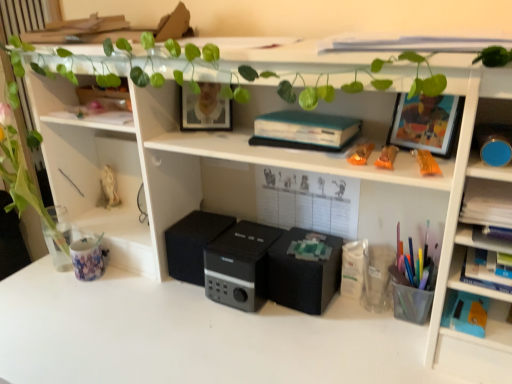
Identify the location of printed ceramic mug at left, arranged as the second stationery when viewed from the top. (88, 258).

The image size is (512, 384). What do you see at coordinates (239, 265) in the screenshot? I see `black matte speaker at center, the 2th speaker from the right` at bounding box center [239, 265].

Measure the distance between matte white statue at left and camera.

The distance of matte white statue at left from camera is 4.57 feet.

Describe the element at coordinates (304, 130) in the screenshot. The width and height of the screenshot is (512, 384). I see `teal matte book at center` at that location.

At what (x,y) coordinates should I click in order to perform the action: click on translucent orange pen at upper right, the 2th stationery viewed from the left. Please return your answer as a coordinate pair (x, y). Looking at the image, I should click on (387, 157).

Locate an element on the screen. This screenshot has height=384, width=512. printed ceramic mug at left, acting as the 3th stationery starting from the front is located at coordinates (88, 258).

From their relative heights in the image, would you say translucent plastic cup at right, which ranks as the third stationery in top-to-bottom order, is taller or shorter than green leafy plant at left?

translucent plastic cup at right, which ranks as the third stationery in top-to-bottom order, is shorter than green leafy plant at left.

In the image, is translucent plastic cup at right, which is counted as the 1th stationery, starting from the bottom, on the left side or the right side of green leafy plant at left?

In the image, translucent plastic cup at right, which is counted as the 1th stationery, starting from the bottom, appears on the right side of green leafy plant at left.

Is translucent plastic cup at right, the second stationery viewed from the front, completely or partially outside of green leafy plant at left?

Yes, translucent plastic cup at right, the second stationery viewed from the front, is located beyond the bounds of green leafy plant at left.

Is translucent plastic cup at right, marked as the third stationery in a left-to-right arrangement, bigger than green leafy plant at left?

No, translucent plastic cup at right, marked as the third stationery in a left-to-right arrangement, is not bigger than green leafy plant at left.

Would you say teal matte book at center is outside hardcover book at right?

Indeed, teal matte book at center is completely outside hardcover book at right.

Who is taller, teal matte book at center or hardcover book at right?

teal matte book at center is taller.

How many degrees apart are the facing directions of teal matte book at center and hardcover book at right?

2.97 degrees separate the facing orientations of teal matte book at center and hardcover book at right.

Which object is thinner, teal matte book at center or hardcover book at right?

teal matte book at center.

Is matte white statue at left located outside black matte speaker at center, the 2th speaker from the right?

Yes, matte white statue at left is not within black matte speaker at center, the 2th speaker from the right.

The width and height of the screenshot is (512, 384). In the image, there is a black matte speaker at center, the 2th speaker from the right. What are the coordinates of `toy above it (from the image's perspective)` in the screenshot? It's located at (108, 189).

What's the angular difference between matte white statue at left and black matte speaker at center, which is the 2th speaker from left to right,'s facing directions?

The facing directions of matte white statue at left and black matte speaker at center, which is the 2th speaker from left to right, are 3.46 degrees apart.

Does matte white statue at left turn towards black matte speaker at center, the 2th speaker from the right?

No, matte white statue at left is not oriented towards black matte speaker at center, the 2th speaker from the right.

In the scene shown: Measure the distance from black matte speaker at center, which is the third speaker in right-to-left order, to black matte speaker at center, positioned as the first speaker in right-to-left order.

black matte speaker at center, which is the third speaker in right-to-left order, is 10.19 inches from black matte speaker at center, positioned as the first speaker in right-to-left order.

From the image's perspective, who appears lower, black matte speaker at center, which is the third speaker in right-to-left order, or black matte speaker at center, positioned as the first speaker in right-to-left order?

black matte speaker at center, positioned as the first speaker in right-to-left order, from the image's perspective.

From a real-world perspective, between black matte speaker at center, which is the 1th speaker in left-to-right order, and black matte speaker at center, positioned as the first speaker in right-to-left order, who is vertically higher?

In real-world perspective, black matte speaker at center, which is the 1th speaker in left-to-right order, is above.

Can you confirm if black matte speaker at center, which is the 1th speaker in left-to-right order, is smaller than black matte speaker at center, positioned as the first speaker in right-to-left order?

No, black matte speaker at center, which is the 1th speaker in left-to-right order, is not smaller than black matte speaker at center, positioned as the first speaker in right-to-left order.

Is translucent orange pen at upper right, which is the 1th stationery from top to bottom, aimed at hardcover book at right?

No, translucent orange pen at upper right, which is the 1th stationery from top to bottom, is not turned towards hardcover book at right.

From the picture: Who is bigger, translucent orange pen at upper right, arranged as the 2th stationery when viewed from the right, or hardcover book at right?

hardcover book at right is bigger.

Identify the location of stationery above the hardcover book at right (from the image's perspective). (387, 157).

How much distance is there between translucent orange pen at upper right, the 3th stationery when ordered from bottom to top, and hardcover book at right?

translucent orange pen at upper right, the 3th stationery when ordered from bottom to top, is 10.25 inches away from hardcover book at right.

Would you say teal matte book at center is outside translucent plastic cup at right, the second stationery viewed from the front?

Absolutely, teal matte book at center is external to translucent plastic cup at right, the second stationery viewed from the front.

Which of these two, teal matte book at center or translucent plastic cup at right, the second stationery viewed from the front, is bigger?

teal matte book at center is bigger.

In the scene shown: Considering the sizes of objects teal matte book at center and translucent plastic cup at right, which is the first stationery in right-to-left order, in the image provided, who is thinner, teal matte book at center or translucent plastic cup at right, which is the first stationery in right-to-left order,?

With smaller width is translucent plastic cup at right, which is the first stationery in right-to-left order.

From the image's perspective, which is above, teal matte book at center or translucent plastic cup at right, which ranks as the third stationery in top-to-bottom order?

teal matte book at center, from the image's perspective.

From a real-world perspective, relative to translucent plastic cup at right, which is counted as the 1th stationery, starting from the bottom, is black matte speaker at center, which is the 2th speaker from left to right, vertically above or below?

From a real-world perspective, black matte speaker at center, which is the 2th speaker from left to right, is physically above translucent plastic cup at right, which is counted as the 1th stationery, starting from the bottom.

Based on the photo, from the image's perspective, which one is positioned lower, black matte speaker at center, which is the 2th speaker from left to right, or translucent plastic cup at right, which is counted as the 1th stationery, starting from the bottom?

translucent plastic cup at right, which is counted as the 1th stationery, starting from the bottom, is shown below in the image.

Choose the correct answer: Is black matte speaker at center, which is the 2th speaker from left to right, inside translucent plastic cup at right, marked as the third stationery in a left-to-right arrangement, or outside it?

black matte speaker at center, which is the 2th speaker from left to right, is not inside translucent plastic cup at right, marked as the third stationery in a left-to-right arrangement, it's outside.

Is black matte speaker at center, the 2th speaker from the right, oriented away from translucent plastic cup at right, which is counted as the 1th stationery, starting from the bottom?

That's not correct — black matte speaker at center, the 2th speaker from the right, is not looking away from translucent plastic cup at right, which is counted as the 1th stationery, starting from the bottom.

From a real-world perspective, starting from the green leafy plant at left, which stationery is the 1st one below it? Please provide its 2D coordinates.

[(414, 284)]

This screenshot has width=512, height=384. What are the coordinates of `paperback book that appears above the hardcover book at right (from a real-world perspective)` in the screenshot? It's located at coord(304,130).

Looking at this image, based on their spatial positions, is black matte speaker at center, positioned as the first speaker in right-to-left order, or black matte speaker at center, which is the third speaker in right-to-left order, further from green leafy plant at left?

Based on the image, black matte speaker at center, positioned as the first speaker in right-to-left order, appears to be further to green leafy plant at left.

Considering their positions, is translucent orange pen at upper right, arranged as the 2th stationery when viewed from the right, positioned closer to matte white statue at left than black matte speaker at center, positioned as the first speaker in right-to-left order?

black matte speaker at center, positioned as the first speaker in right-to-left order.

When comparing their distances from translucent plastic cup at right, which is the first stationery in right-to-left order, does green leafy plant at left or translucent orange pen at upper right, the 2th stationery viewed from the left, seem closer?

translucent orange pen at upper right, the 2th stationery viewed from the left, is closer to translucent plastic cup at right, which is the first stationery in right-to-left order.

Estimate the real-world distances between objects in this image. Which object is closer to black matte speaker at center, positioned as the first speaker in right-to-left order, black matte speaker at center, which is the 1th speaker in left-to-right order, or black matte speaker at center, which is the 2th speaker from left to right?

black matte speaker at center, which is the 2th speaker from left to right, is closer to black matte speaker at center, positioned as the first speaker in right-to-left order.

From the image, which object appears to be nearer to matte white statue at left, black matte speaker at center, which is the 1th speaker in left-to-right order, or teal matte book at center?

black matte speaker at center, which is the 1th speaker in left-to-right order, is positioned closer to the anchor matte white statue at left.

Estimate the real-world distances between objects in this image. Which object is closer to green leafy plant at left, printed ceramic mug at left, arranged as the second stationery when viewed from the top, or translucent plastic cup at right, marked as the third stationery in a left-to-right arrangement?

Among the two, printed ceramic mug at left, arranged as the second stationery when viewed from the top, is located nearer to green leafy plant at left.

Based on their spatial positions, is translucent orange pen at upper right, the 3th stationery when ordered from bottom to top, or teal matte book at center further from printed ceramic mug at left, which appears as the first stationery when viewed from the left?

translucent orange pen at upper right, the 3th stationery when ordered from bottom to top, is further to printed ceramic mug at left, which appears as the first stationery when viewed from the left.

Based on their spatial positions, is black matte speaker at center, which is the 2th speaker from left to right, or teal matte book at center further from black matte speaker at center, which is the third speaker in right-to-left order?

Based on the image, teal matte book at center appears to be further to black matte speaker at center, which is the third speaker in right-to-left order.

Where is `stationery between green leafy plant at left and teal matte book at center in the horizontal direction`? This screenshot has height=384, width=512. stationery between green leafy plant at left and teal matte book at center in the horizontal direction is located at coordinates coord(88,258).

Identify the location of paperback book between black matte speaker at center, which is the 1th speaker in left-to-right order, and translucent orange pen at upper right, which is the 1th stationery from top to bottom, from left to right. (304, 130).

At what (x,y) coordinates should I click in order to perform the action: click on paperback book between black matte speaker at center, which is the third speaker in right-to-left order, and translucent plastic cup at right, the second stationery viewed from the front. Please return your answer as a coordinate pair (x, y). Looking at the image, I should click on click(304, 130).

This screenshot has height=384, width=512. Find the location of `toy located between green leafy plant at left and black matte speaker at center, which is the 2th speaker from left to right, in the left-right direction`. toy located between green leafy plant at left and black matte speaker at center, which is the 2th speaker from left to right, in the left-right direction is located at coordinates (108, 189).